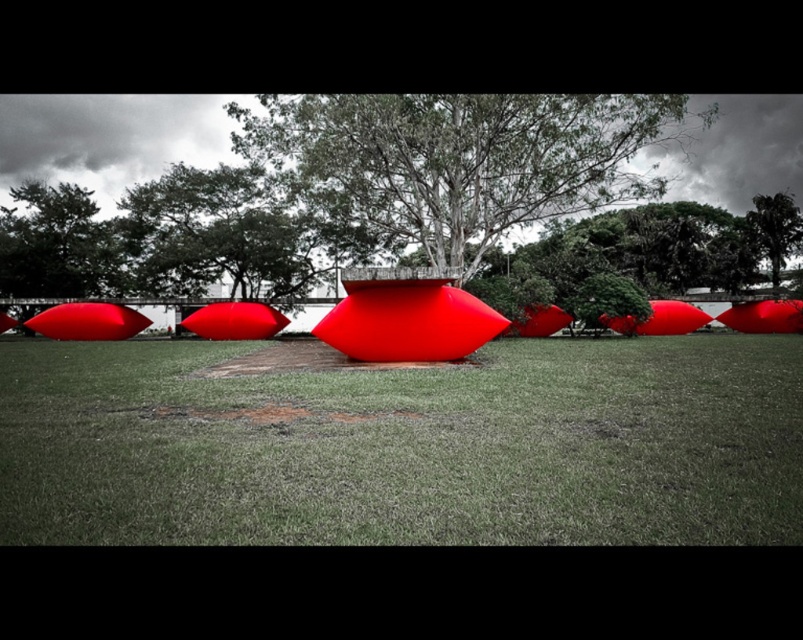
Question: Considering the relative positions of green leafy tree at center and green leafy tree at upper center in the image provided, where is green leafy tree at center located with respect to green leafy tree at upper center?

Choices:
 (A) left
 (B) right

Answer: (A)

Question: Which of these objects is positioned farthest from the green leafy tree at center?

Choices:
 (A) green leafy tree at upper center
 (B) matte red object at center

Answer: (A)

Question: Is matte red object at center bigger than green leafy tree at center?

Choices:
 (A) no
 (B) yes

Answer: (A)

Question: Is green leafy tree at center thinner than green leafy tree at upper center?

Choices:
 (A) no
 (B) yes

Answer: (A)

Question: Estimate the real-world distances between objects in this image. Which object is farther from the green leafy tree at upper center?

Choices:
 (A) green leafy tree at center
 (B) matte red object at center

Answer: (B)

Question: Among these objects, which one is nearest to the camera?

Choices:
 (A) green leafy tree at center
 (B) green leafy tree at upper center
 (C) matte red object at center

Answer: (C)